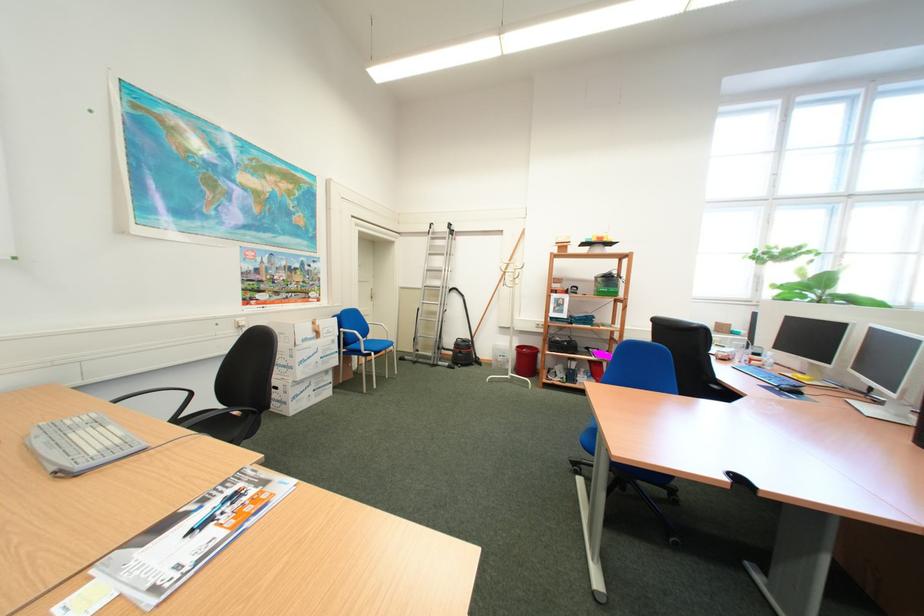
Where would you rest the black chair armrest? Please return your answer as a coordinate pair (x, y).

(214, 422)